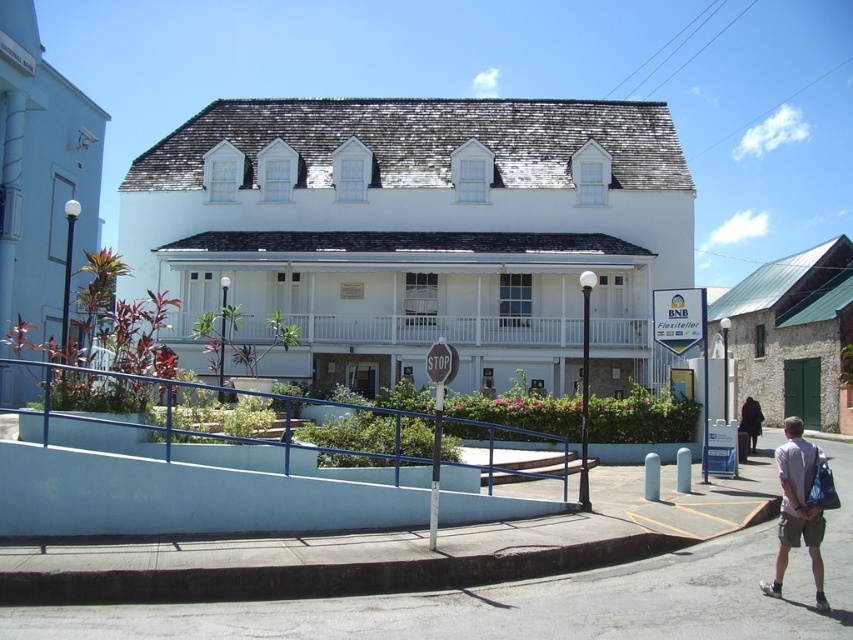
Question: Which point is closer to the camera?

Choices:
 (A) (183, 444)
 (B) (769, 582)
 (C) (743, 417)

Answer: (B)

Question: Among these objects, which one is nearest to the camera?

Choices:
 (A) blue metal railing at center
 (B) dark brown leather jacket at lower right
 (C) gray fabric backpack at lower right

Answer: (C)

Question: Can you confirm if blue metal railing at center is positioned above dark brown leather jacket at lower right?

Choices:
 (A) no
 (B) yes

Answer: (B)

Question: Can you confirm if blue metal railing at center is positioned above dark brown leather jacket at lower right?

Choices:
 (A) yes
 (B) no

Answer: (A)

Question: Is the position of gray fabric backpack at lower right less distant than that of dark brown leather jacket at lower right?

Choices:
 (A) yes
 (B) no

Answer: (A)

Question: Which is farther from the dark brown leather jacket at lower right?

Choices:
 (A) gray fabric backpack at lower right
 (B) blue metal railing at center

Answer: (B)